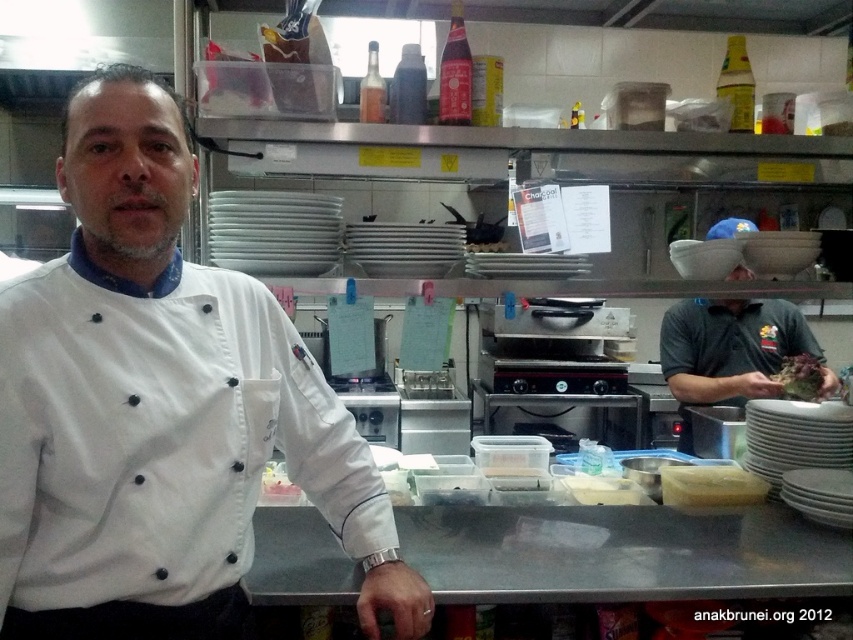
You are a chef in the kitchen and need to place a new dish on the counter. The dish requires the brown matte food at center to be placed to the left of the green leafy vegetable at center. Can you confirm if the current arrangement meets this requirement?

The green leafy vegetable at center is currently to the right of the brown matte food at center, so the current arrangement already meets the requirement that the brown matte food at center is to the left of the green leafy vegetable at center.

You are a new chef in the kitchen and need to place the yellow matte cheese at center on top of the white matte chef coat at center. Is this possible based on their sizes?

A: The white matte chef coat at center is taller than the yellow matte cheese at center, so placing the cheese on top would not be possible since the coat is taller and likely occupies the vertical space above it.

From the picture: You are a kitchen assistant who needs to retrieve the yellow matte cheese at center for a recipe. However, the white matte chef coat at center is blocking access to it. Can you easily reach the cheese without moving the coat?

The white matte chef coat at center is located above the yellow matte cheese at center, so you can easily reach the cheese without moving the coat since it is placed below the coat.